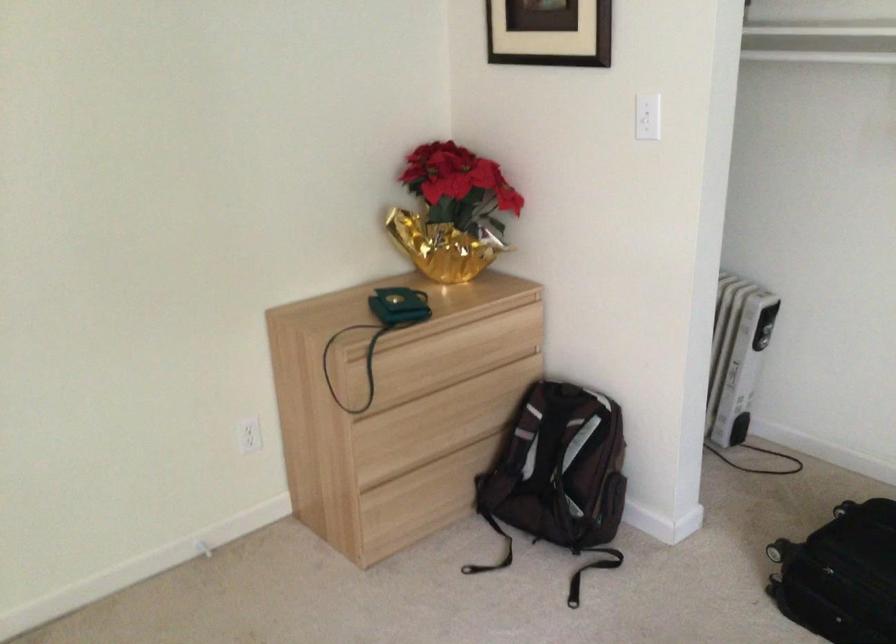
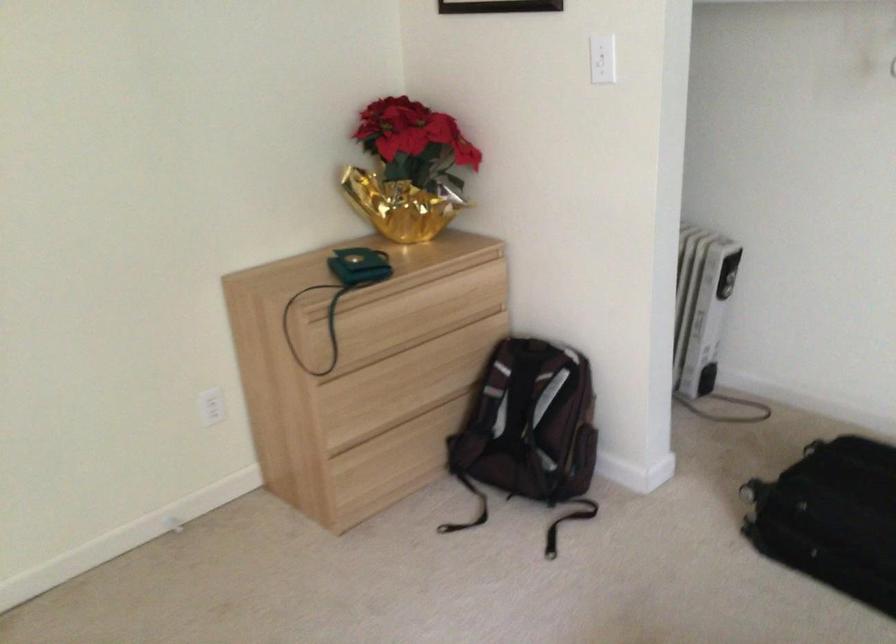
Locate, in the second image, the point that corresponds to point 397,375 in the first image.

(362, 335)